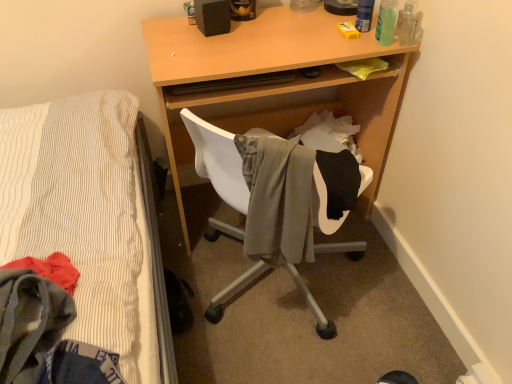
Image resolution: width=512 pixels, height=384 pixels. What are the coordinates of `free space between translucent plastic bottle at upper right, the 3th bottle positioned from the right, and clear plastic bottle at upper right, marked as the third bottle in a left-to-right arrangement` in the screenshot? It's located at (382, 33).